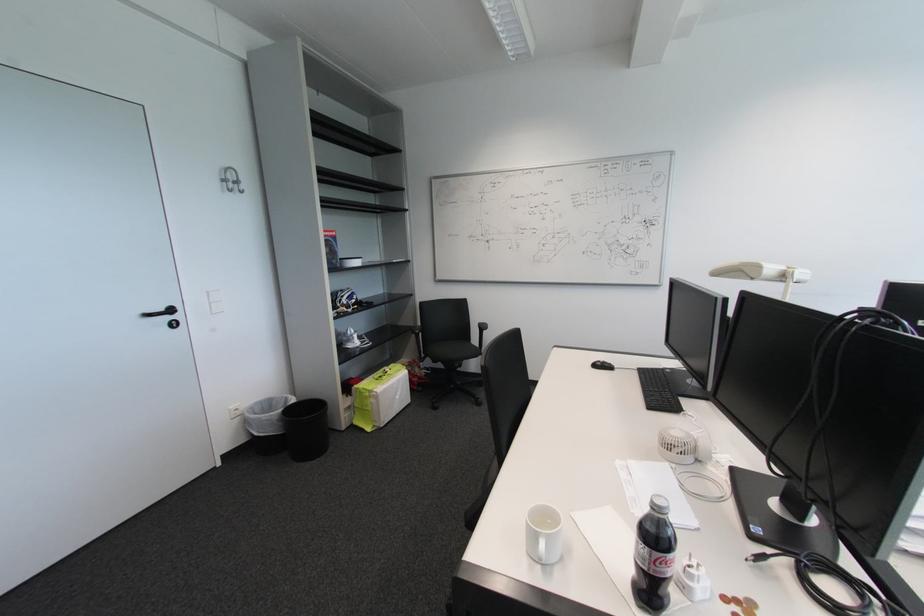
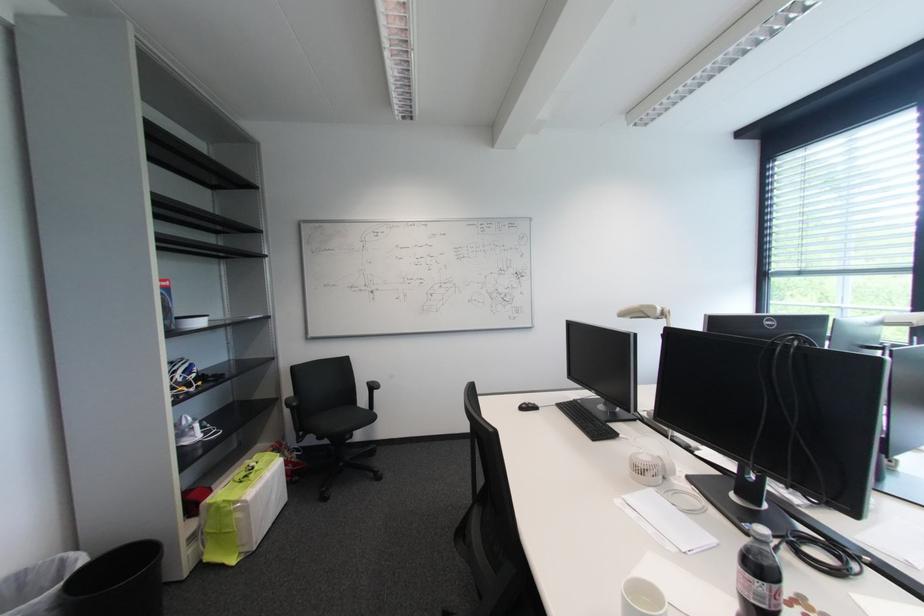
Question: I am providing you with two images of the same scene from different viewpoints. Please identify which objects are invisible in image2.

Choices:
 (A) telephone receiver
 (B) black keyboard
 (C) white round container
 (D) none of these

Answer: (D)